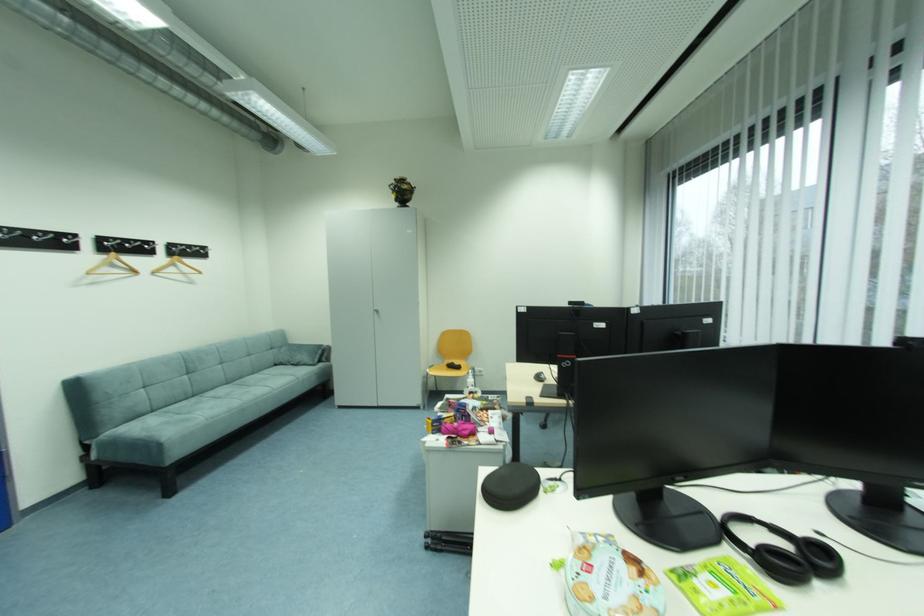
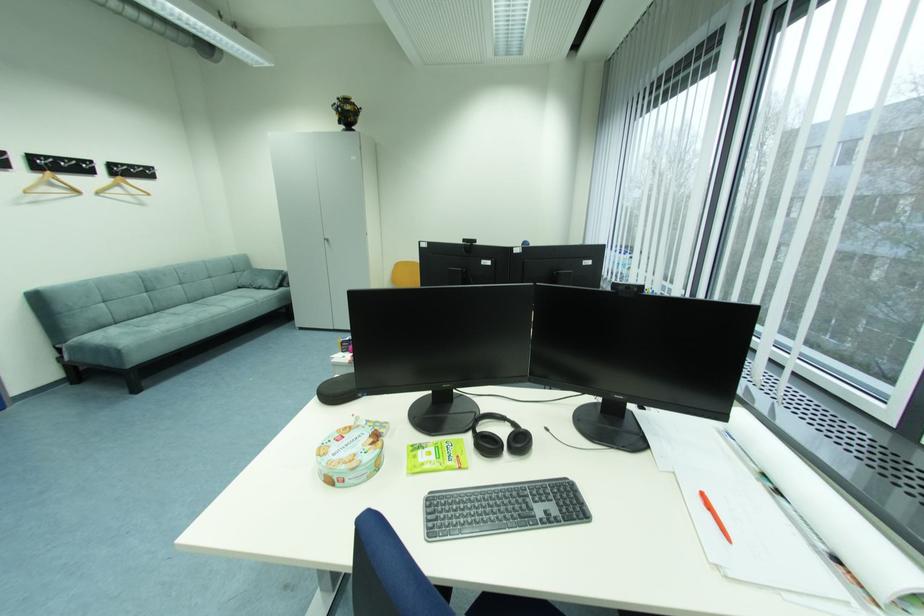
Where in the second image is the point corresponding to point 681,578 from the first image?

(418, 450)